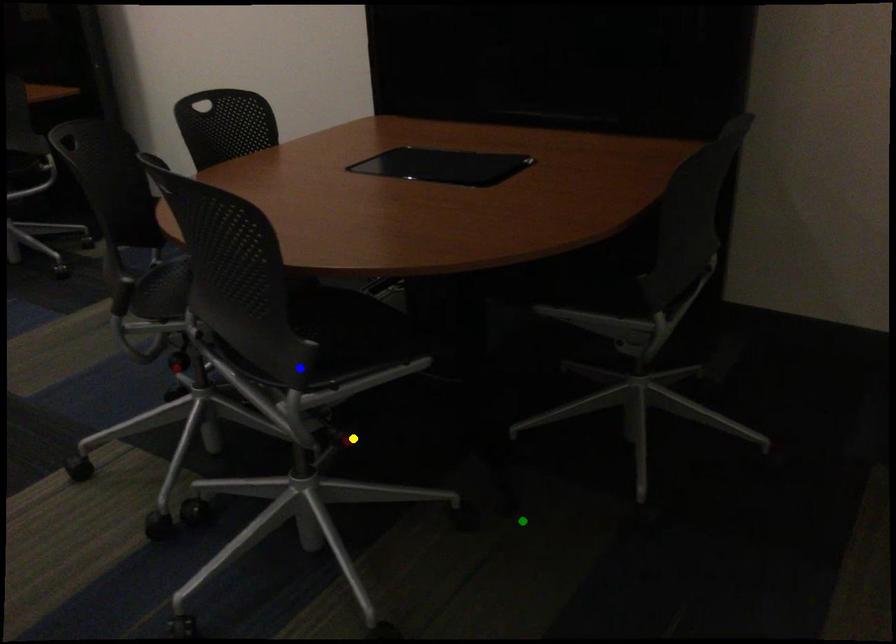
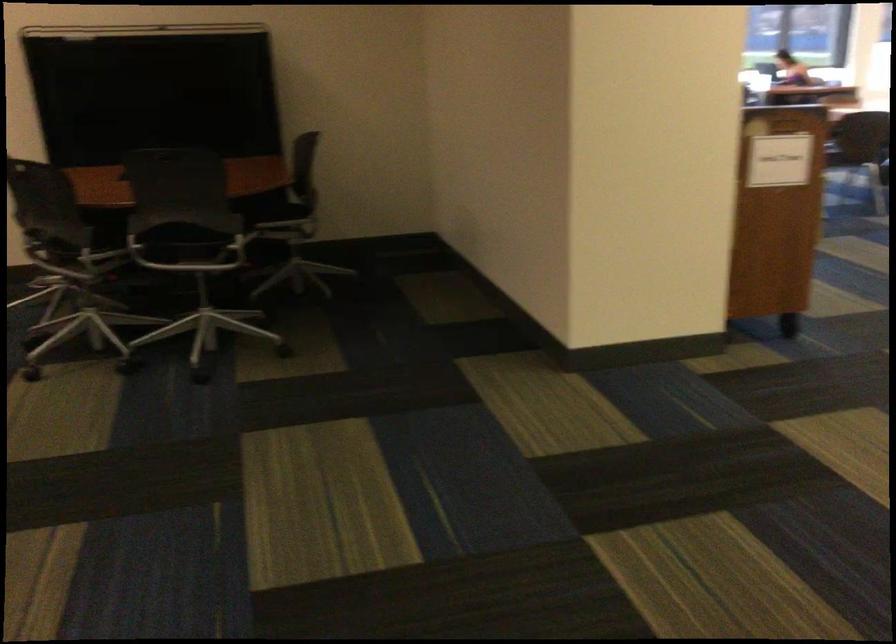
I am providing you with two images of the same scene from different viewpoints. Three points are marked in image1. Which point corresponds to a part or object that is occluded in image2?In image1, three points are marked. Which of them correspond to a part or object that is occluded in image2?Among the three points shown in image1, which one corresponds to a part or object that is no longer visible due to occlusion in image2?

yellow point, blue point cannot be seen in image2.